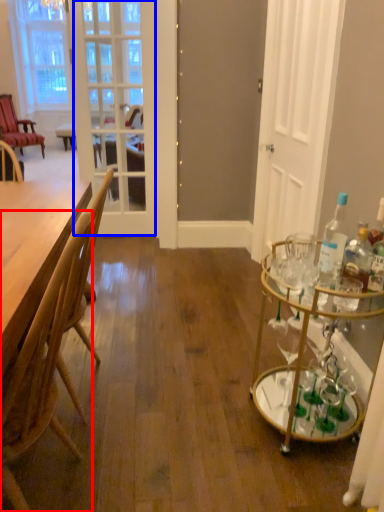
Question: Which object appears farthest to the camera in this image, chair (highlighted by a red box) or screen door (highlighted by a blue box)?

Choices:
 (A) chair
 (B) screen door

Answer: (B)